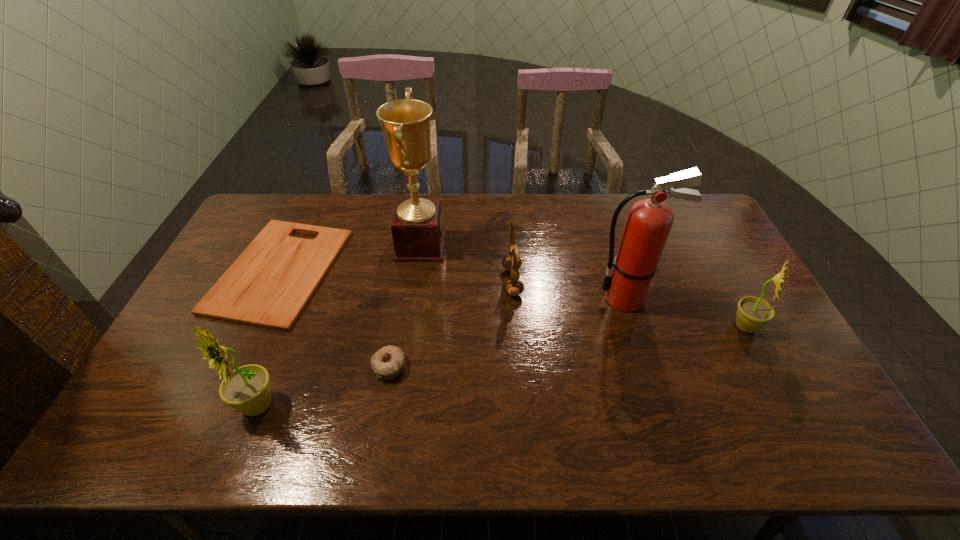
You are a GUI agent. You are given a task and a screenshot of the screen. Output one action in this format:
    pyautogui.click(x=<x>, y=<y>)
    Task: Click on the sixth farthest object
    Image resolution: width=960 pixels, height=540 pixels.
    Given the screenshot: What is the action you would take?
    pyautogui.click(x=388, y=362)

Find the location of `blank space located 0.120m on the plaque of the trophy cup`. blank space located 0.120m on the plaque of the trophy cup is located at coordinates (480, 246).

I want to click on vacant region located on the hose direction of the fire extinguisher, so click(479, 299).

What are the coordinates of `vacant space located 0.220m on the hose direction of the fire extinguisher` in the screenshot? It's located at (519, 299).

Identify the location of blank space located on the hose direction of the fire extinguisher. This screenshot has width=960, height=540. (499, 299).

Find the location of a particular element. free location located 0.090m on the front-facing side of the earphone is located at coordinates (473, 282).

Locate an element on the screen. Image resolution: width=960 pixels, height=540 pixels. vacant position located 0.400m on the front-facing side of the earphone is located at coordinates click(374, 282).

Image resolution: width=960 pixels, height=540 pixels. Identify the location of free space located 0.140m on the front-facing side of the earphone. (458, 282).

Locate an element on the screen. The height and width of the screenshot is (540, 960). vacant space located 0.210m on the right of the shortest object is located at coordinates (406, 271).

At what (x,y) coordinates should I click in order to perform the action: click on free space located 0.310m on the left of the second shortest object. Please return your answer as a coordinate pair (x, y). Looking at the image, I should click on (254, 366).